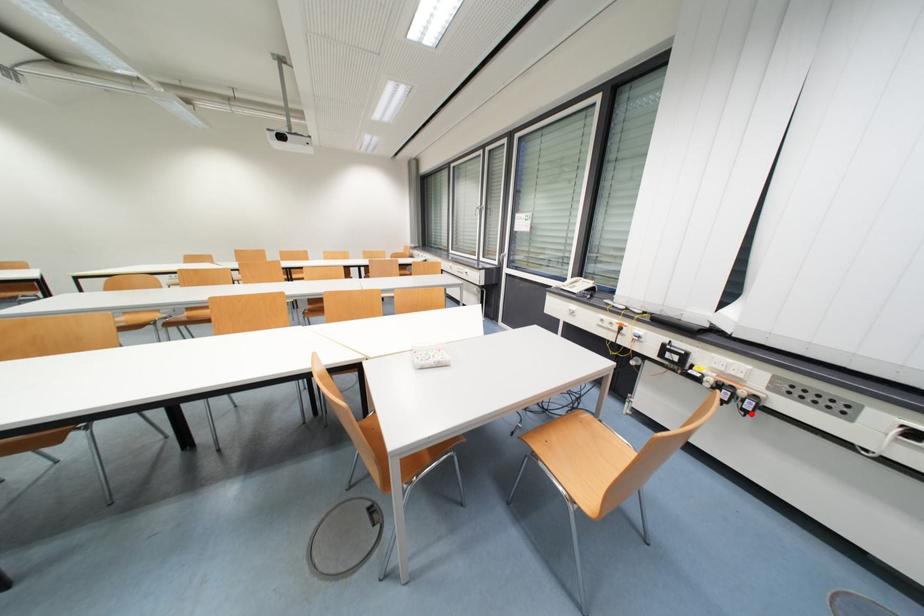
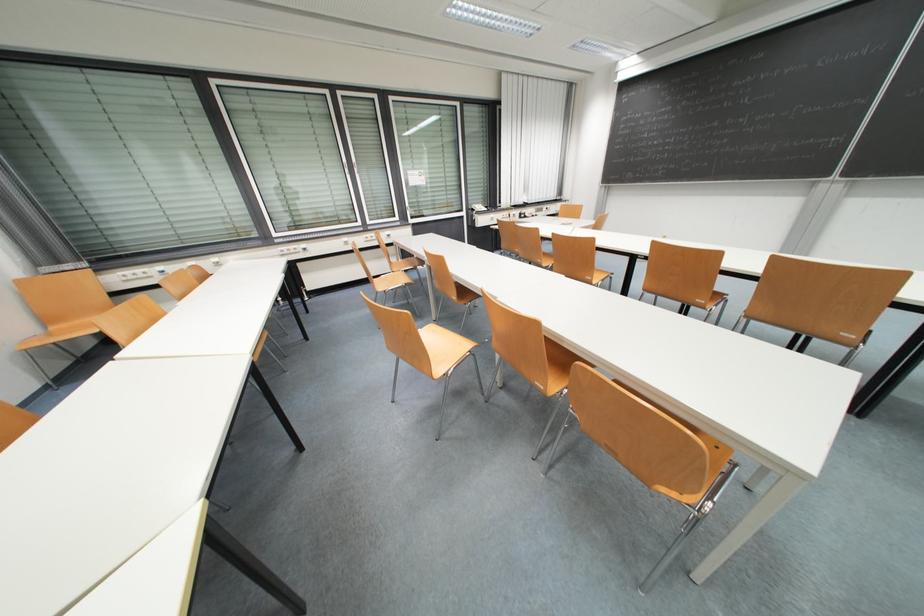
Question: I am providing you with two images of the same scene from different viewpoints. A red point is marked on the first image. Can you still see the location of the red point in image 2?

Choices:
 (A) Yes
 (B) No

Answer: (B)